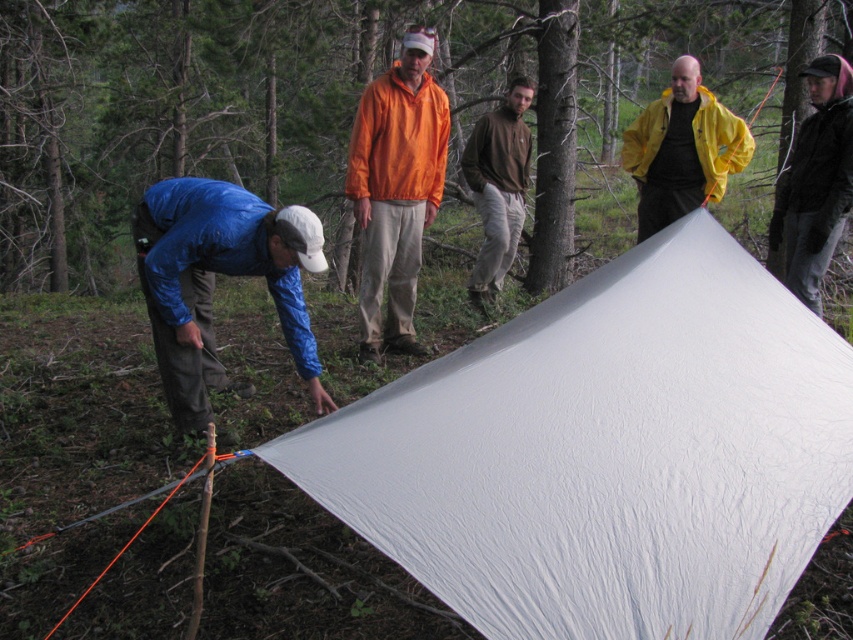
You are a photographer positioned at the edge of the forest, aiming to capture a photo of the yellow matte jacket at upper right and the brown cotton shirt at center. Based on their heights, which one would appear closer to the top of the photo frame?

The yellow matte jacket at upper right has a lesser height compared to brown cotton shirt at center, so the brown cotton shirt at center would appear closer to the top of the photo frame.